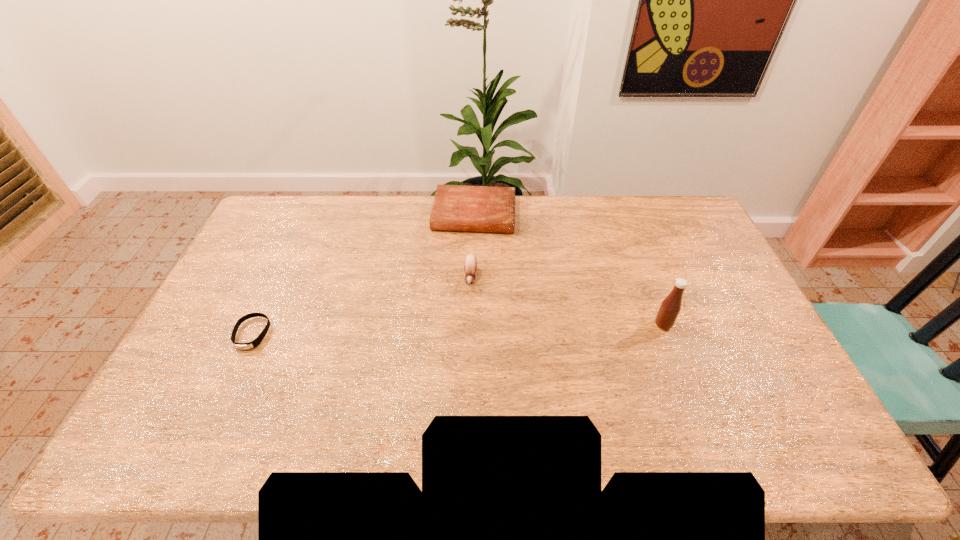
Image resolution: width=960 pixels, height=540 pixels. I want to click on wristband, so click(x=250, y=345).

Where is `the leftmost object`? The height and width of the screenshot is (540, 960). the leftmost object is located at coordinates (250, 345).

Locate an element on the screen. the tallest object is located at coordinates (671, 305).

The width and height of the screenshot is (960, 540). In order to click on the rightmost object in this screenshot , I will do `click(671, 305)`.

The height and width of the screenshot is (540, 960). Identify the location of Bible. (456, 207).

Where is `the farthest object`? This screenshot has width=960, height=540. the farthest object is located at coordinates (456, 207).

Where is `the second tallest object`? The height and width of the screenshot is (540, 960). the second tallest object is located at coordinates (470, 263).

Identify the location of escargot. The image size is (960, 540). (470, 263).

Image resolution: width=960 pixels, height=540 pixels. I want to click on free space located on the display of the leftmost object, so click(x=234, y=373).

At what (x,y) coordinates should I click in order to perform the action: click on free location located 0.160m on the left of the tallest object. Please return your answer as a coordinate pair (x, y). The image size is (960, 540). Looking at the image, I should click on (599, 325).